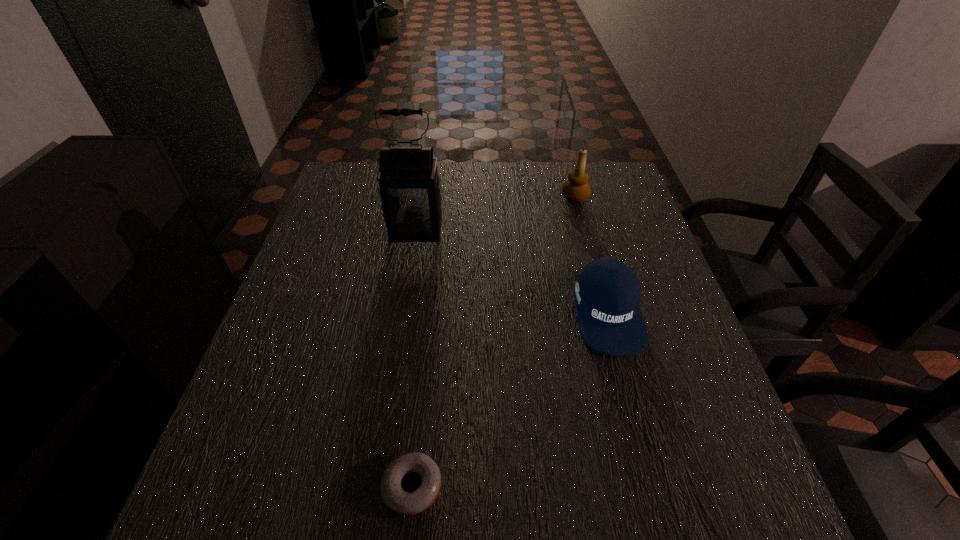
Where is `empty location between the second tallest object and the baseball cap`? empty location between the second tallest object and the baseball cap is located at coordinates (591, 255).

The height and width of the screenshot is (540, 960). In order to click on free spot between the farthest object and the third farthest object in this screenshot , I will do `click(591, 255)`.

Image resolution: width=960 pixels, height=540 pixels. In order to click on vacant area between the tallest object and the second tallest object in this screenshot , I will do `click(495, 214)`.

Find the location of a particular element. the closest object relative to the lantern is located at coordinates (607, 293).

The width and height of the screenshot is (960, 540). Find the location of `object that is the closest one to the third tallest object`. object that is the closest one to the third tallest object is located at coordinates coord(576,189).

The image size is (960, 540). I want to click on vacant position in the image that satisfies the following two spatial constraints: 1. on the back side of the candle_holder; 2. on the left side of the shortest object, so click(x=443, y=197).

The width and height of the screenshot is (960, 540). I want to click on free location that satisfies the following two spatial constraints: 1. on the back side of the shortest object; 2. on the left side of the candle_holder, so click(x=443, y=197).